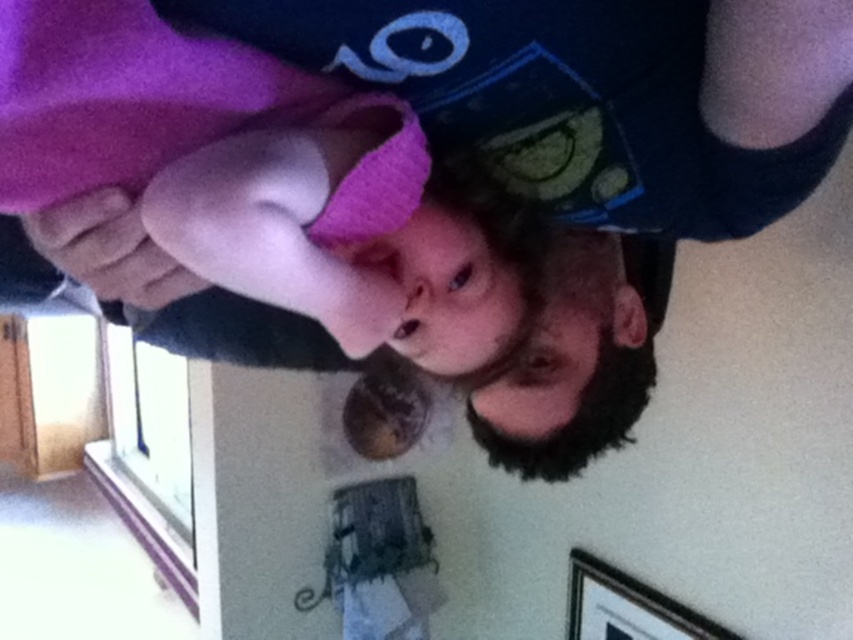
This screenshot has width=853, height=640. Describe the element at coordinates (245, 173) in the screenshot. I see `purple fleece at upper left` at that location.

Looking at this image, does purple fleece at upper left have a greater height compared to wooden picture frame at lower right?

No.

The image size is (853, 640). I want to click on purple fleece at upper left, so click(245, 173).